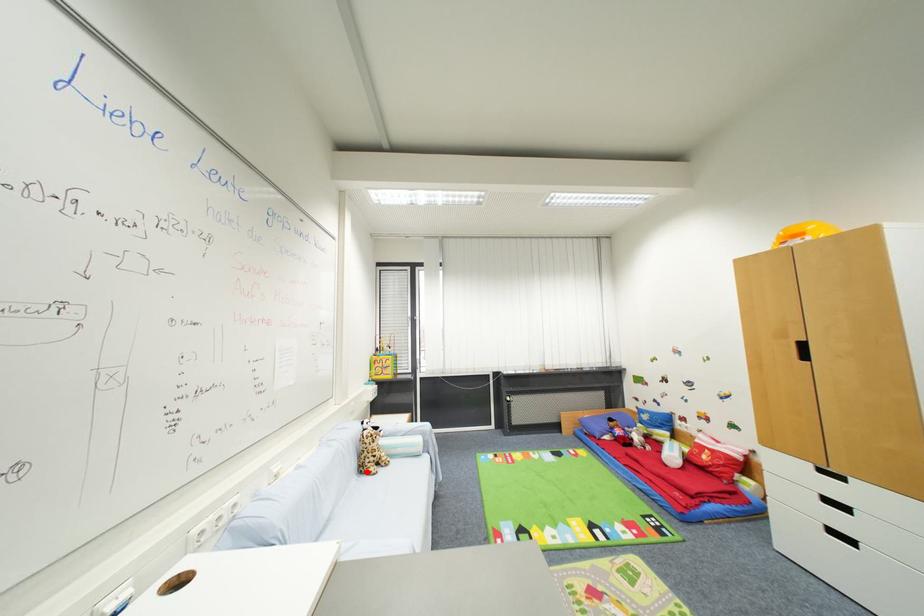
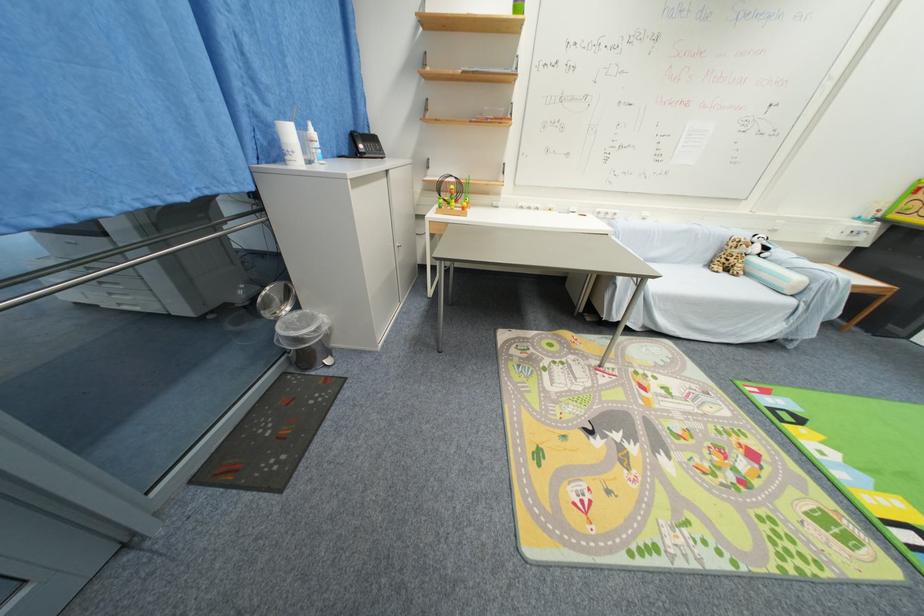
Locate, in the second image, the point that corresponds to the highlighted location in the first image.

(714, 265)